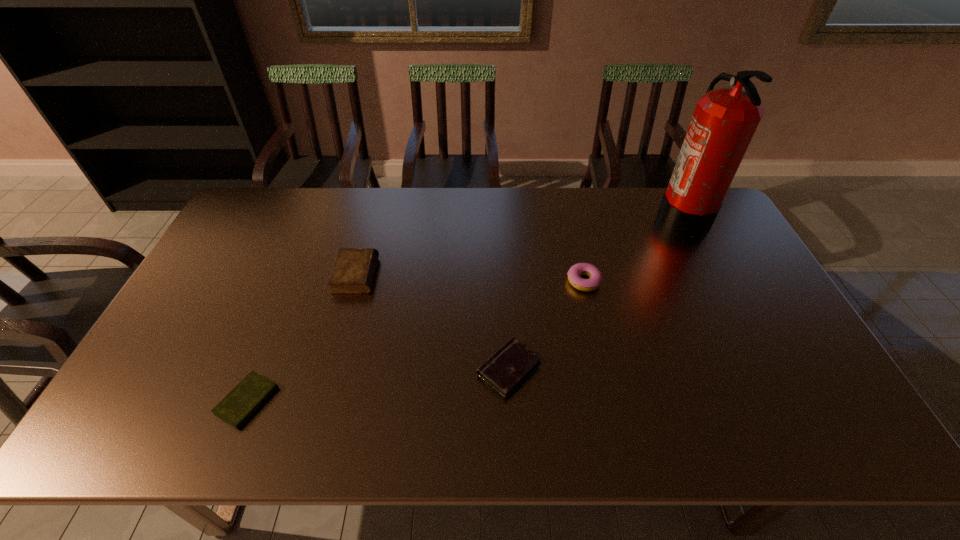
Find the location of a particular element. The height and width of the screenshot is (540, 960). vacant space that satisfies the following two spatial constraints: 1. on the front side of the fire extinguisher; 2. on the front side of the second shortest diary is located at coordinates (x=762, y=369).

Find the location of a particular element. The width and height of the screenshot is (960, 540). vacant point that satisfies the following two spatial constraints: 1. on the back side of the rightmost diary; 2. on the right side of the shortest object is located at coordinates (260, 369).